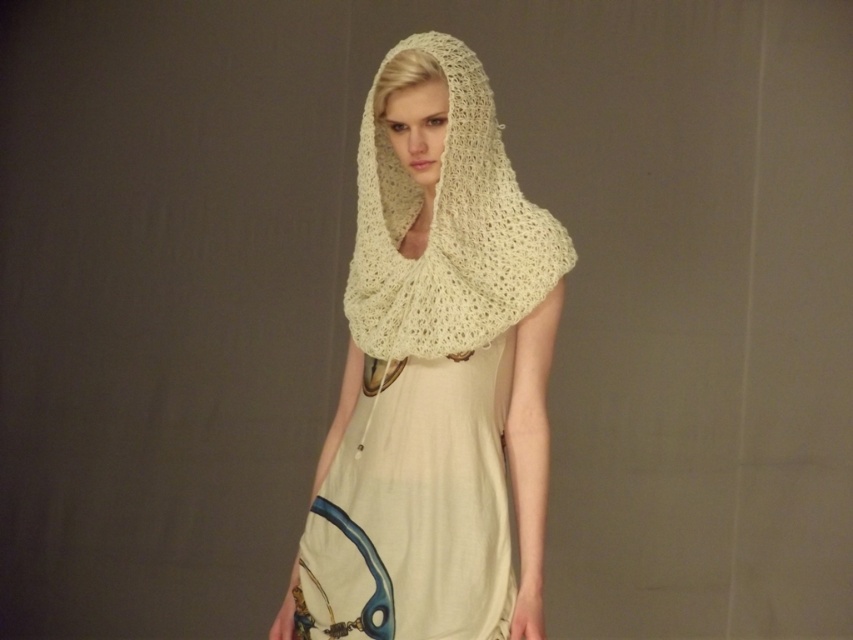
Does ivory knitted shawl at center have a greater height compared to light beige cotton dress at center?

Yes.

Is point (421, 209) positioned in front of point (395, 492)?

No, (421, 209) is further to viewer.

At what (x,y) coordinates should I click in order to perform the action: click on ivory knitted shawl at center. Please return your answer as a coordinate pair (x, y). The image size is (853, 640). Looking at the image, I should click on (434, 376).

Is ivory knitted shawl at center shorter than creamy knit shawl at center?

In fact, ivory knitted shawl at center may be taller than creamy knit shawl at center.

Does point (491, 406) lie in front of point (544, 292)?

No, it is not.

This screenshot has height=640, width=853. I want to click on ivory knitted shawl at center, so click(434, 376).

This screenshot has width=853, height=640. What do you see at coordinates (415, 509) in the screenshot?
I see `light beige cotton dress at center` at bounding box center [415, 509].

Which is below, light beige cotton dress at center or creamy knit shawl at center?

light beige cotton dress at center is below.

The width and height of the screenshot is (853, 640). I want to click on light beige cotton dress at center, so click(x=415, y=509).

Find the location of `light beige cotton dress at center`. light beige cotton dress at center is located at coordinates (415, 509).